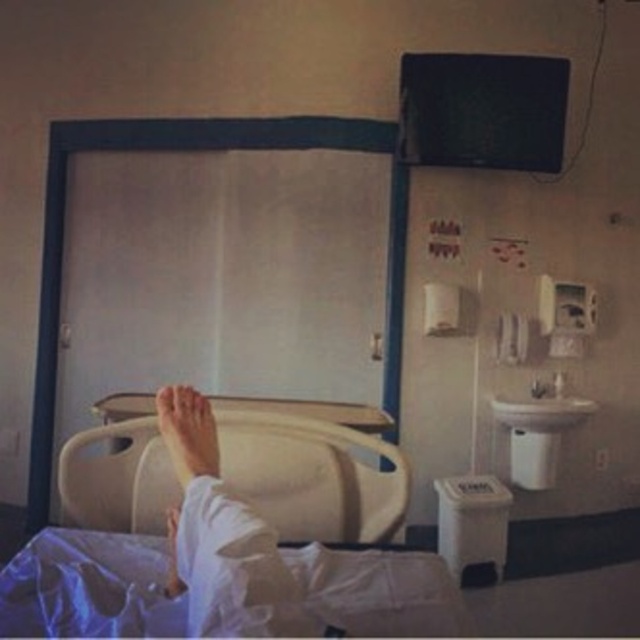
You are a nurse in the hospital room and need to retrieve an item from point A at point [129,454] and point B at point [173,576]. Which point is closer to the patient lying on the bed?

Point B at point [173,576] is closer to the patient lying on the bed because point A is behind point B according to their coordinates.

You are a nurse checking the hospital room. You see the white plastic bed at lower center and the beige plastic hospital bed at lower center. Which bed is higher in height?

The white plastic bed at lower center is taller than the beige plastic hospital bed at lower center.